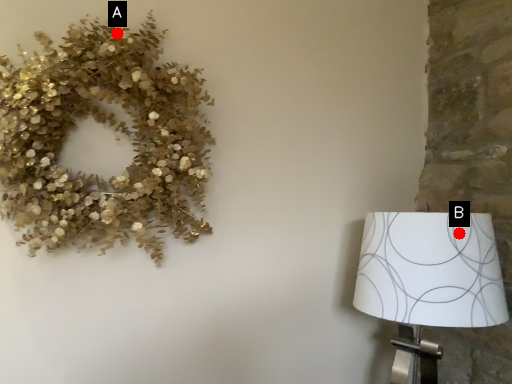
Question: Two points are circled on the image, labeled by A and B beside each circle. Which point appears farthest from the camera in this image?

Choices:
 (A) A is further
 (B) B is further

Answer: (A)